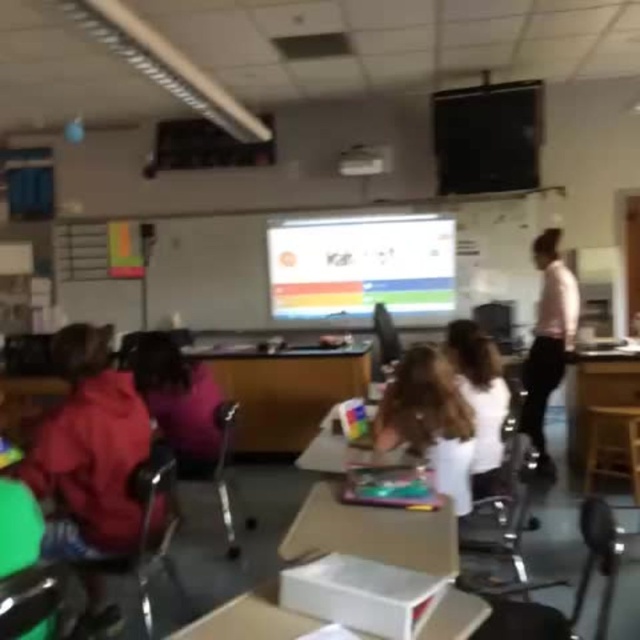
Does wooden desk at center appear on the left side of wooden stool at lower right?

Indeed, wooden desk at center is positioned on the left side of wooden stool at lower right.

Between wooden desk at center and wooden stool at lower right, which one has more height?

wooden desk at center

Is point (288, 428) positioned in front of point (624, 468)?

No, (288, 428) is behind (624, 468).

The height and width of the screenshot is (640, 640). I want to click on wooden desk at center, so click(285, 392).

Find the location of a particular element. This screenshot has width=640, height=640. wooden desk at center is located at coordinates (285, 392).

Image resolution: width=640 pixels, height=640 pixels. Identify the location of wooden desk at center. (285, 392).

Is point (316, 413) closer to viewer compared to point (461, 497)?

That is False.

Does point (221, 376) come behind point (442, 467)?

Yes, point (221, 376) is behind point (442, 467).

Locate an element on the screen. The height and width of the screenshot is (640, 640). wooden desk at center is located at coordinates (285, 392).